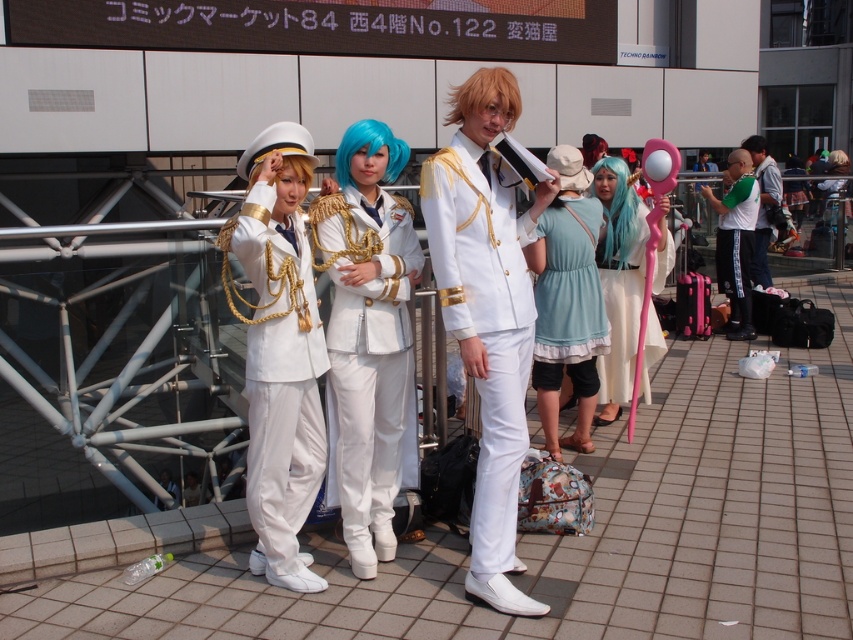
Looking at this image, you are a photographer trying to capture a photo of the green jersey at right and the white glossy uniform at right. Which costume should you focus on first if you want to start from the left side of the group?

The green jersey at right is to the left of the white glossy uniform at right, so you should focus on the green jersey at right first.

You are a photographer trying to capture a photo of the green jersey at right and the white glossy uniform at right. Which costume should you focus on first if you want to ensure both are in frame without zooming in or out?

You should focus on the green jersey at right first because it is larger in size than the white glossy uniform at right, so it will take up more space in the frame.

You are standing in front of the group and want to greet the person in the white glossy uniform at center and the light blue cotton dress at center. Which one should you approach first if you want to greet the person on the left side of the group?

You should approach the white glossy uniform at center first because it is positioned to the left of the light blue cotton dress at center, making it closer to your left side.